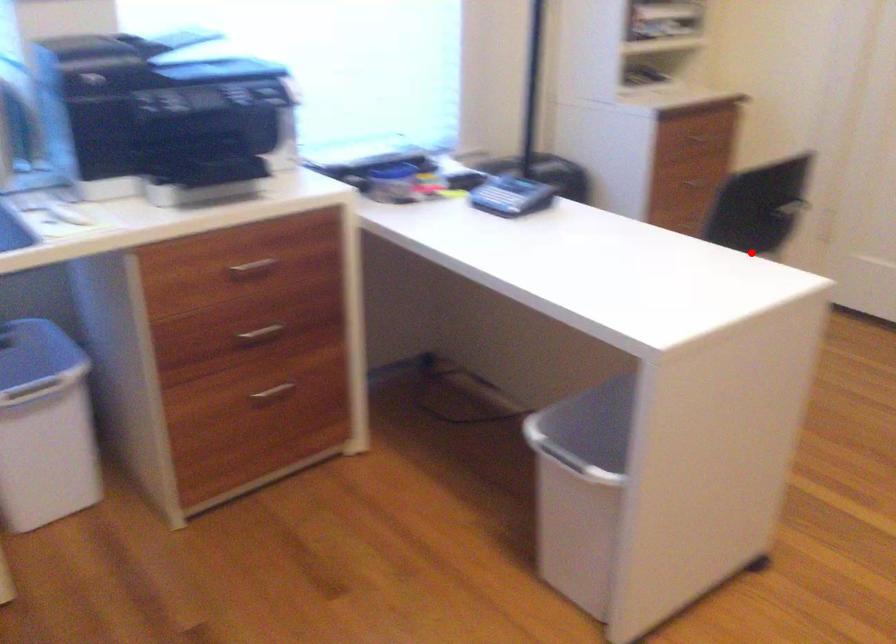
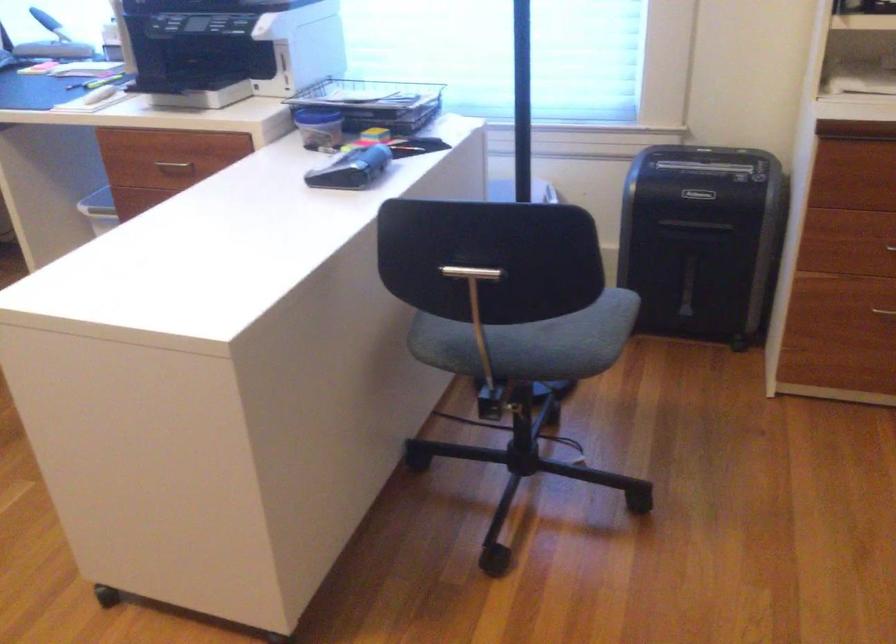
Locate, in the second image, the point that corresponds to the highlighted location in the first image.

(476, 308)